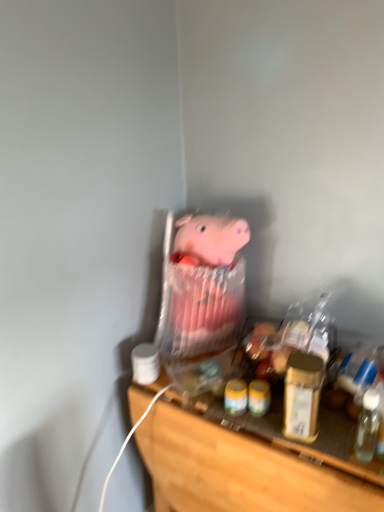
At what (x,y) coordinates should I click in order to perform the action: click on free location to the right of gold metallic jar at right. Please return your answer as a coordinate pair (x, y). Looking at the image, I should click on (338, 434).